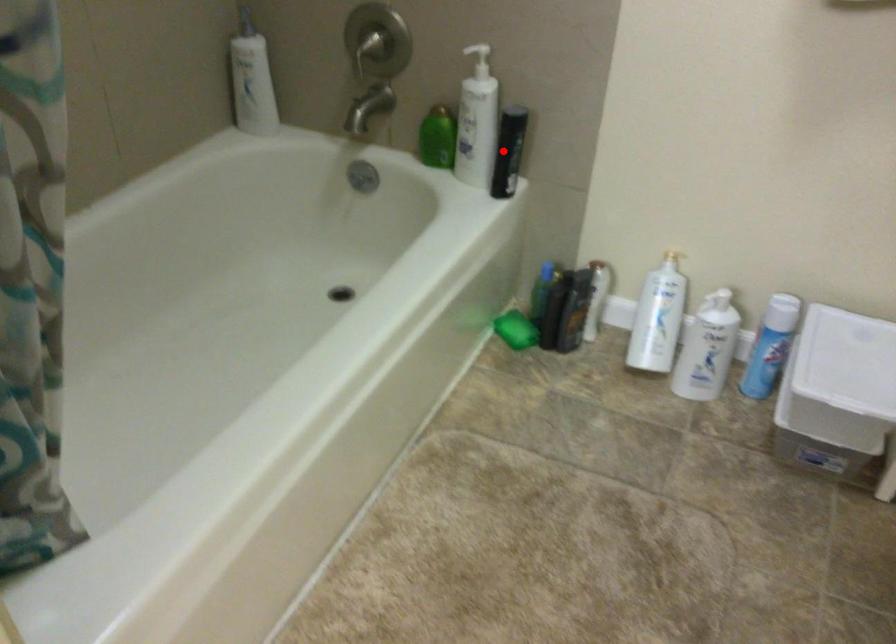
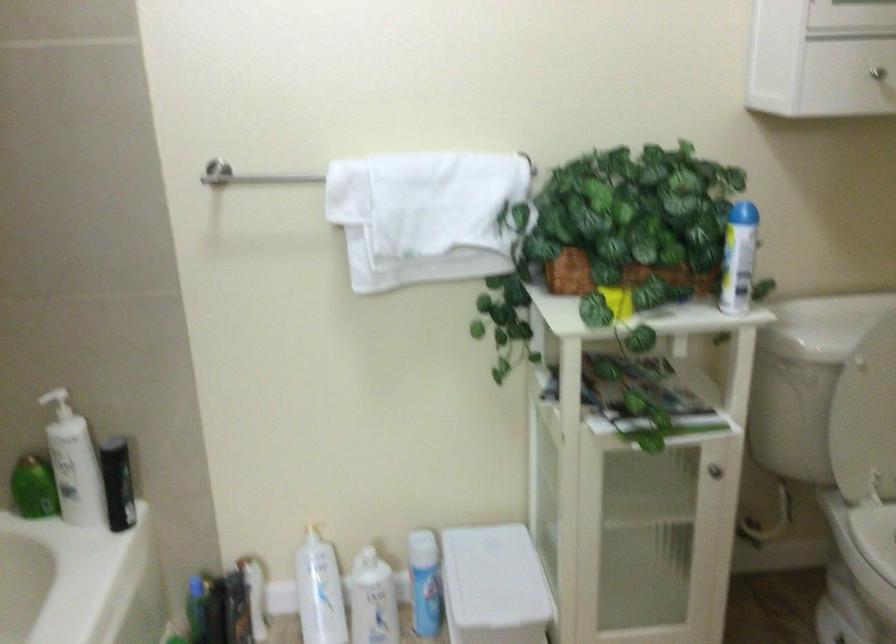
Find the pixel in the second image that matches the highlighted location in the first image.

(117, 483)